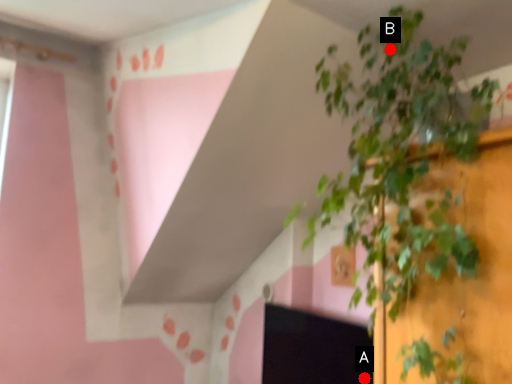
Question: Two points are circled on the image, labeled by A and B beside each circle. Which of the following is the closest to the observer?

Choices:
 (A) A is closer
 (B) B is closer

Answer: (B)